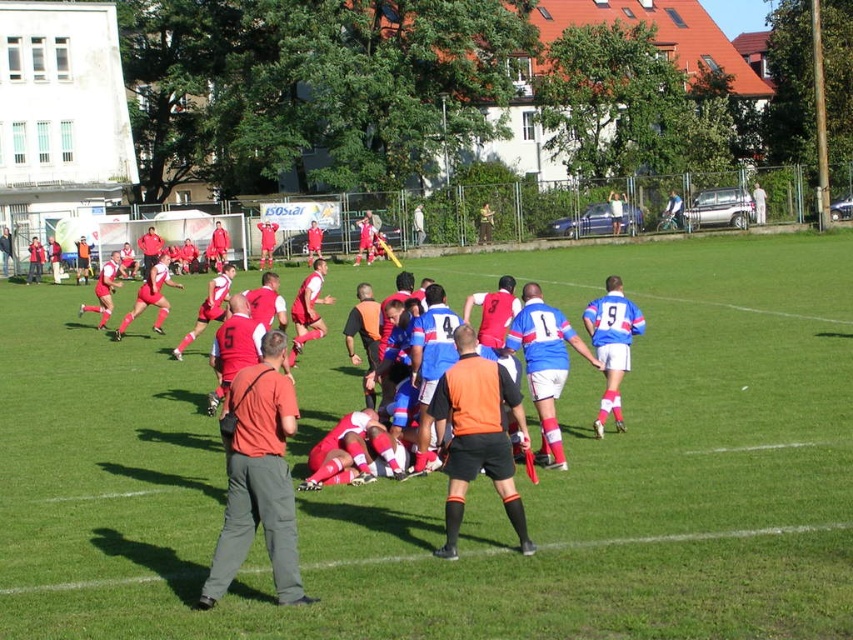
How much distance is there between orange shirt at center and orange mesh vest at center?

The distance of orange shirt at center from orange mesh vest at center is 4.71 feet.

Is orange shirt at center below orange mesh vest at center?

Yes, orange shirt at center is below orange mesh vest at center.

Locate an element on the screen. orange shirt at center is located at coordinates (258, 476).

This screenshot has width=853, height=640. What are the coordinates of `orange shirt at center` in the screenshot? It's located at (258, 476).

From the picture: Can you confirm if orange shirt at center is thinner than blue fabric jersey at center?

No.

Who is taller, orange shirt at center or blue fabric jersey at center?

orange shirt at center is taller.

What do you see at coordinates (258, 476) in the screenshot? I see `orange shirt at center` at bounding box center [258, 476].

Where is `orange shirt at center`? orange shirt at center is located at coordinates (258, 476).

Can you confirm if green grass football field at center is positioned below orange shirt at center?

No, green grass football field at center is not below orange shirt at center.

Does point (583, 512) come closer to viewer compared to point (230, 384)?

Yes, point (583, 512) is in front of point (230, 384).

Identify the location of green grass football field at center. (474, 483).